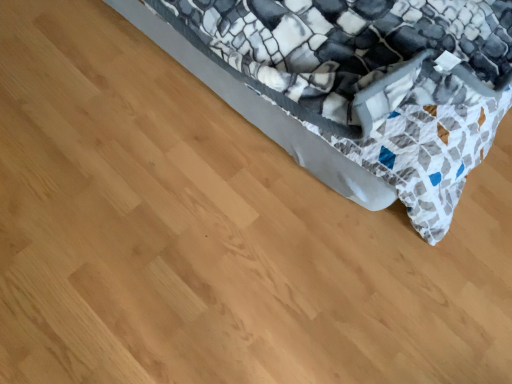
Where is `vacant point above patterned fabric couch at upper right (from a real-world perspective)`? The width and height of the screenshot is (512, 384). vacant point above patterned fabric couch at upper right (from a real-world perspective) is located at coordinates (136, 189).